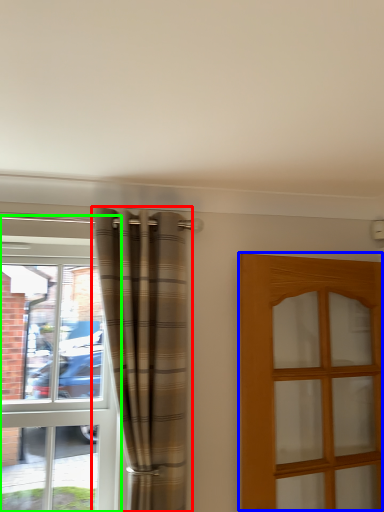
Question: Which is nearer to the curtain (highlighted by a red box)? door (highlighted by a blue box) or window (highlighted by a green box).

Choices:
 (A) door
 (B) window

Answer: (B)